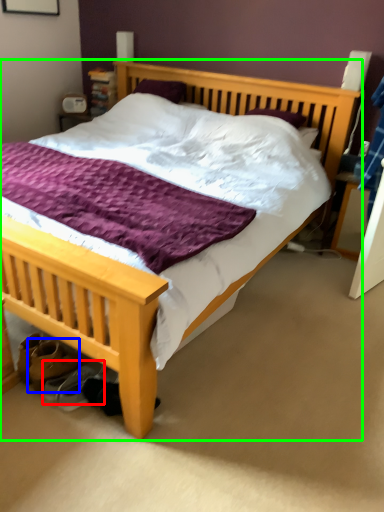
Question: Considering the real-world distances, which object is closest to shoe (highlighted by a red box)? footwear (highlighted by a blue box) or bed (highlighted by a green box).

Choices:
 (A) footwear
 (B) bed

Answer: (A)